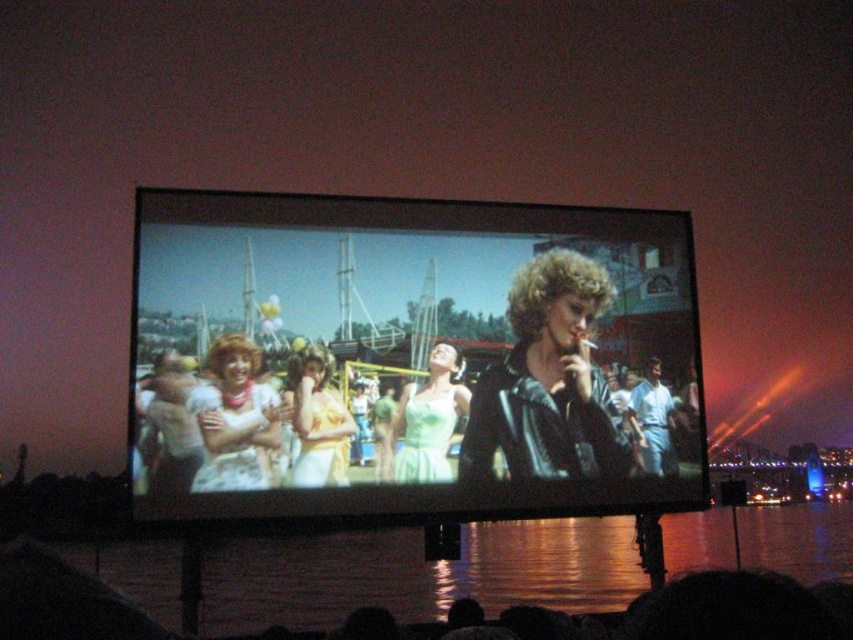
Looking at this image, which is more to the right, glistening water at bottom or matte white dress at center?

From the viewer's perspective, glistening water at bottom appears more on the right side.

Who is more distant from viewer, (721, 548) or (231, 444)?

The point (721, 548) is behind.

What do you see at coordinates (560, 560) in the screenshot?
I see `glistening water at bottom` at bounding box center [560, 560].

At what (x,y) coordinates should I click in order to perform the action: click on glistening water at bottom. Please return your answer as a coordinate pair (x, y). The width and height of the screenshot is (853, 640). Looking at the image, I should click on click(x=560, y=560).

Is point (619, 528) in front of point (299, 358)?

No, it is behind (299, 358).

Does glistening water at bottom have a lesser height compared to matte yellow dress at center?

Correct, glistening water at bottom is not as tall as matte yellow dress at center.

The height and width of the screenshot is (640, 853). Describe the element at coordinates (560, 560) in the screenshot. I see `glistening water at bottom` at that location.

What are the coordinates of `glistening water at bottom` in the screenshot? It's located at (560, 560).

Does black leather jacket at center appear on the right side of matte yellow dress at center?

Indeed, black leather jacket at center is positioned on the right side of matte yellow dress at center.

Does black leather jacket at center have a greater height compared to matte yellow dress at center?

Yes.

Find the location of `black leather jacket at center`. black leather jacket at center is located at coordinates (548, 381).

The width and height of the screenshot is (853, 640). Identify the location of black leather jacket at center. (548, 381).